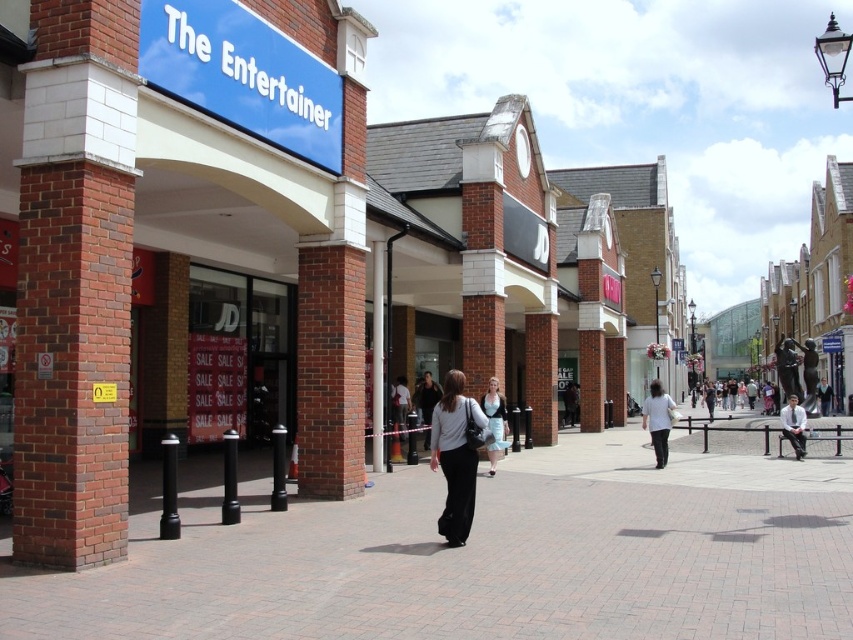
You are a customer in the shopping area and want to buy both the light gray fabric pants at center and the white fabric shirt at center. Which item is closer to your right side when you face the stores?

The white fabric shirt at center is closer to your right side because the light gray fabric pants at center is to the left of it.

You are a delivery person carrying a heavy box and need to cross the street from the brick pavement at center to the white shirt at center. The traffic light is green for pedestrians. Can you safely make this crossing within one green light cycle, assuming an average walking speed of 1.5 meters per second?

The distance between the brick pavement at center and the white shirt at center is 7.98 meters. At a walking speed of 1.5 meters per second, it would take approximately 5.32 seconds to cross. Since most green light cycles for pedestrians last around 10 seconds or more, you can safely cross within one green light cycle.

You are a delivery person carrying a large box that is 1 meter wide. You need to walk through the shopping area shown in the image. Can you pass through the space between the brick pavement at center and the white shirt at center without the box hitting anything?

The brick pavement at center is wider than the white shirt at center. Since the box is 1 meter wide, you need to check if the narrower space between them can accommodate the box. However, the description only states the brick pavement is wider, but does not provide exact measurements. Without specific dimensions, it is uncertain if the 1 meter wide box will fit. Please verify the actual width before proceeding.